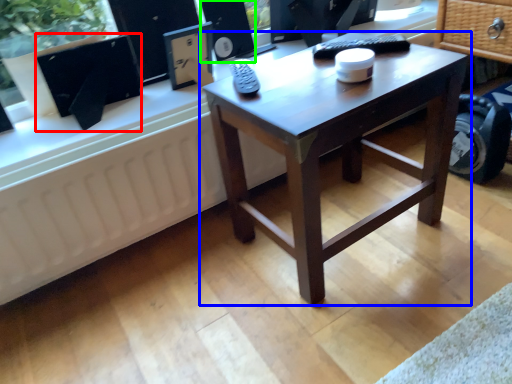
Question: Which object is the farthest from computer monitor (highlighted by a red box)? Choose among these: coffee table (highlighted by a blue box) or speaker (highlighted by a green box).

Choices:
 (A) coffee table
 (B) speaker

Answer: (A)